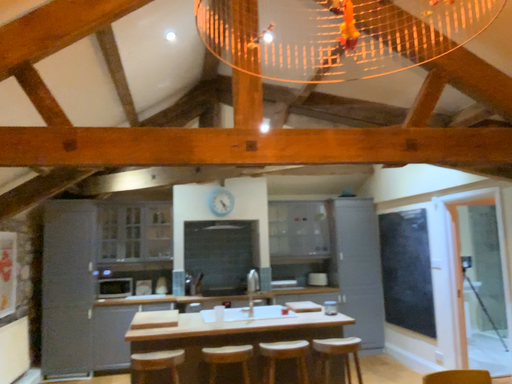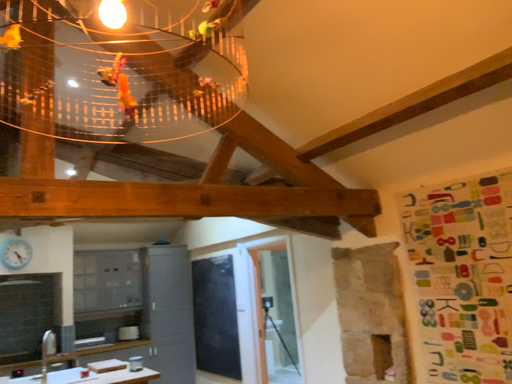
Question: How did the camera likely rotate when shooting the video?

Choices:
 (A) rotated upward
 (B) rotated downward

Answer: (A)